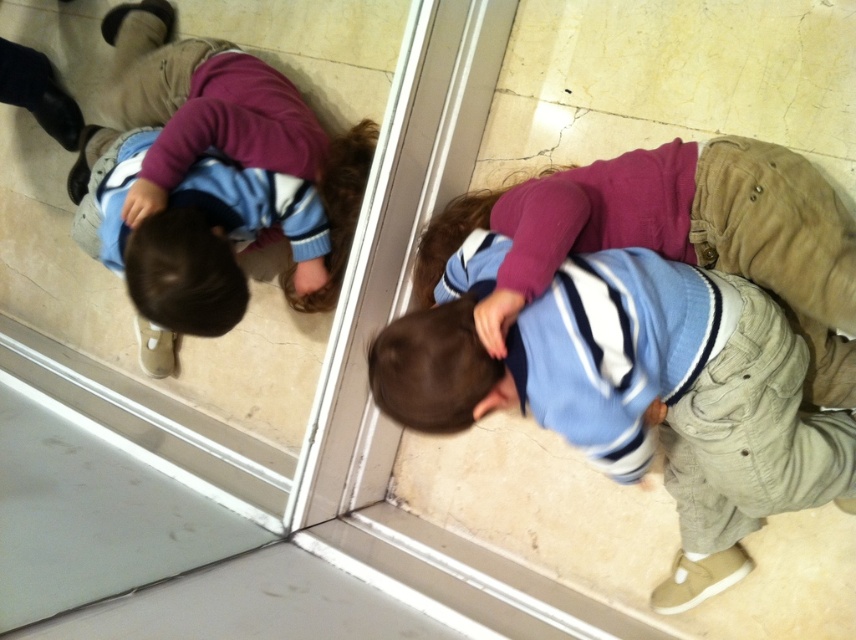
Question: Can you confirm if transparent glass door at center is positioned above matte blue sweater at lower center?

Choices:
 (A) no
 (B) yes

Answer: (B)

Question: Does matte blue sweater at lower center appear over matte blue sweater at center?

Choices:
 (A) no
 (B) yes

Answer: (A)

Question: Which of the following is the farthest from the observer?

Choices:
 (A) transparent glass door at center
 (B) matte blue sweater at center

Answer: (B)

Question: Among these objects, which one is nearest to the camera?

Choices:
 (A) transparent glass door at center
 (B) matte blue sweater at lower center
 (C) matte blue sweater at center

Answer: (A)

Question: Does transparent glass door at center have a larger size compared to matte blue sweater at lower center?

Choices:
 (A) no
 (B) yes

Answer: (B)

Question: Among these objects, which one is nearest to the camera?

Choices:
 (A) matte blue sweater at center
 (B) matte blue sweater at lower center

Answer: (B)